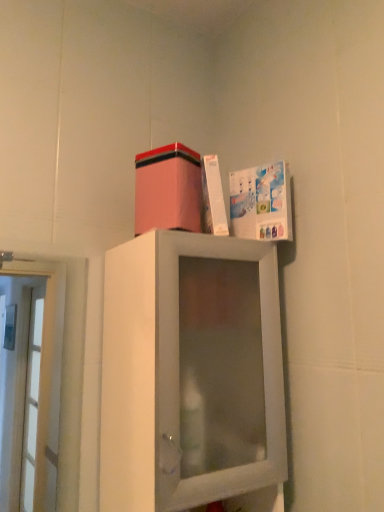
Question: From a real-world perspective, relative to pink matte cardboard box at upper center, is white glossy book at upper right vertically above or below?

Choices:
 (A) below
 (B) above

Answer: (A)

Question: Considering the positions of point (268, 188) and point (155, 187), is point (268, 188) closer or farther from the camera than point (155, 187)?

Choices:
 (A) closer
 (B) farther

Answer: (B)

Question: Which of these objects is positioned farthest from the pink matte cardboard box at upper center?

Choices:
 (A) white glossy book at upper right
 (B) white matte cabinet at upper center

Answer: (B)

Question: Estimate the real-world distances between objects in this image. Which object is farther from the pink matte cardboard box at upper center?

Choices:
 (A) white matte cabinet at upper center
 (B) white glossy book at upper right

Answer: (A)